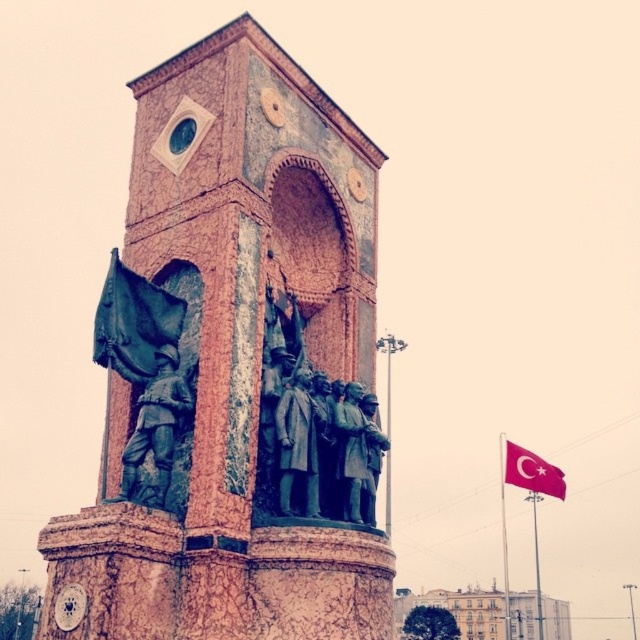
Question: Which point is farther to the camera?

Choices:
 (A) dark blue fabric flag at left
 (B) green patina statue at center

Answer: (A)

Question: Where is rustic stone tower at center located in relation to red fabric flag at right in the image?

Choices:
 (A) below
 (B) above

Answer: (B)

Question: Among these objects, which one is farthest from the camera?

Choices:
 (A) dark blue fabric flag at left
 (B) rustic stone tower at center
 (C) red fabric flag at right
 (D) green patina statue at center

Answer: (C)

Question: Considering the real-world distances, which object is closest to the dark blue fabric flag at left?

Choices:
 (A) red fabric flag at right
 (B) green patina statue at center

Answer: (B)

Question: Is dark blue fabric flag at left above red fabric flag at right?

Choices:
 (A) no
 (B) yes

Answer: (B)

Question: Where is rustic stone tower at center located in relation to green patina statue at center in the image?

Choices:
 (A) right
 (B) left

Answer: (A)